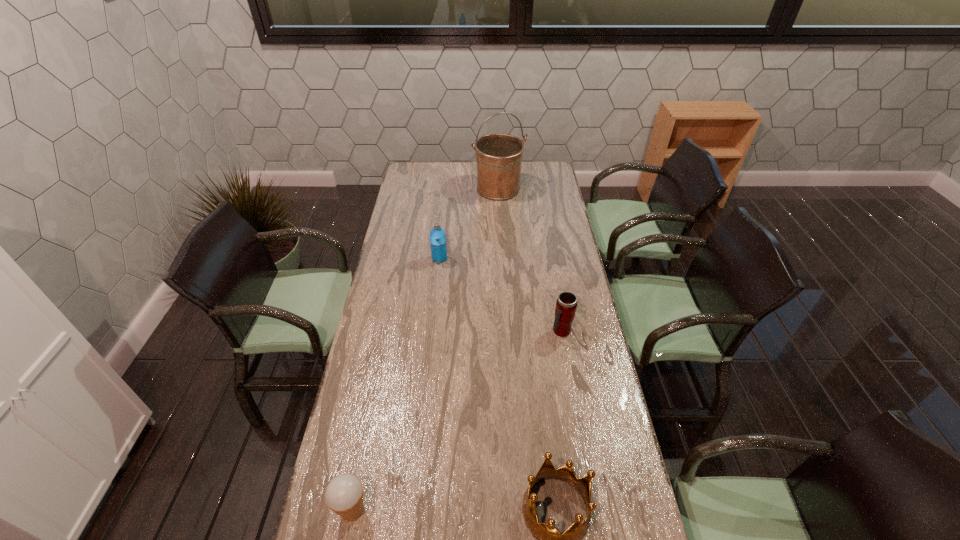
This screenshot has height=540, width=960. In order to click on the farthest object in this screenshot , I will do point(499,156).

At what (x,y) coordinates should I click in order to perform the action: click on the tallest object. Please return your answer as a coordinate pair (x, y). This screenshot has height=540, width=960. Looking at the image, I should click on (499, 156).

The width and height of the screenshot is (960, 540). In order to click on the second farthest object in this screenshot , I will do `click(437, 235)`.

At what (x,y) coordinates should I click in order to perform the action: click on the farther thermos bottle. Please return your answer as a coordinate pair (x, y). The height and width of the screenshot is (540, 960). Looking at the image, I should click on (437, 235).

Where is `the nearer thermos bottle`? The height and width of the screenshot is (540, 960). the nearer thermos bottle is located at coordinates (566, 304).

You are a GUI agent. You are given a task and a screenshot of the screen. Output one action in this format:
    pyautogui.click(x=<x>, y=<y>)
    Task: Click on the right thermos bottle
    The width and height of the screenshot is (960, 540).
    Given the screenshot: What is the action you would take?
    pyautogui.click(x=566, y=304)

Image resolution: width=960 pixels, height=540 pixels. I want to click on the leftmost object, so tap(344, 494).

Image resolution: width=960 pixels, height=540 pixels. Identify the location of vacant space located on the right of the farthest object. (548, 189).

The image size is (960, 540). What are the coordinates of `vacant space situated 0.250m on the front of the fourth object from right to left` in the screenshot? It's located at (435, 306).

What are the coordinates of `free space located 0.140m on the side with the handle of the right thermos bottle` in the screenshot? It's located at (568, 372).